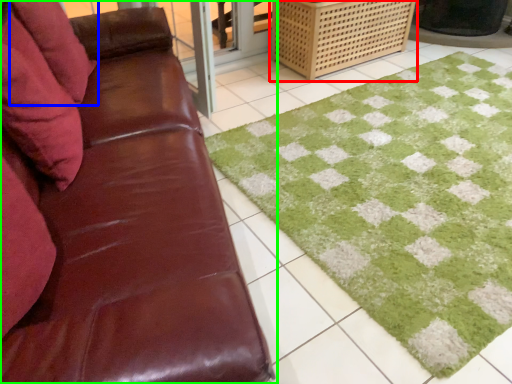
Question: Which object is positioned closest to crate (highlighted by a red box)? Select from pillow (highlighted by a blue box) and studio couch (highlighted by a green box).

Choices:
 (A) pillow
 (B) studio couch

Answer: (A)